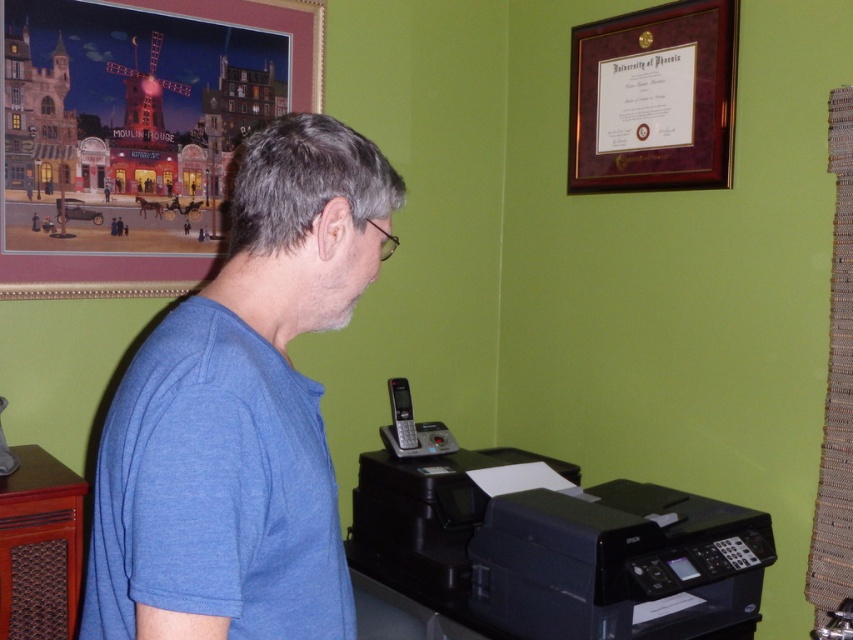
Who is positioned more to the right, black plastic printer at lower right or metallic mesh bulletin board at right?

From the viewer's perspective, metallic mesh bulletin board at right appears more on the right side.

Is point (560, 544) positioned behind point (842, 388)?

That is False.

Does point (701, 614) come farther from viewer compared to point (840, 474)?

No, (701, 614) is in front of (840, 474).

The height and width of the screenshot is (640, 853). In order to click on black plastic printer at lower right in this screenshot , I will do `click(618, 563)`.

Is wooden framed painting at upper left to the right of black plastic printer at lower center from the viewer's perspective?

No, wooden framed painting at upper left is not to the right of black plastic printer at lower center.

The image size is (853, 640). What are the coordinates of `wooden framed painting at upper left` in the screenshot? It's located at 134,132.

Who is shorter, black plastic printer at lower right or black plastic printer at lower center?

Standing shorter between the two is black plastic printer at lower right.

This screenshot has width=853, height=640. Describe the element at coordinates (618, 563) in the screenshot. I see `black plastic printer at lower right` at that location.

This screenshot has height=640, width=853. What do you see at coordinates (618, 563) in the screenshot?
I see `black plastic printer at lower right` at bounding box center [618, 563].

Find the location of `black plastic printer at lower right`. black plastic printer at lower right is located at coordinates (618, 563).